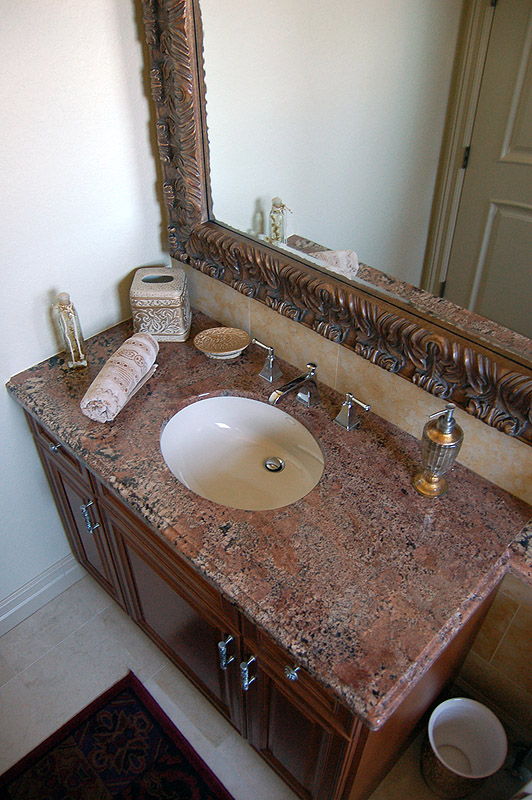
Where is `beige tile floor`? beige tile floor is located at coordinates (124, 650).